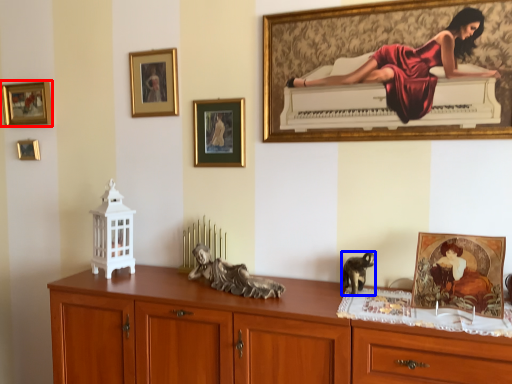
Question: Which object is further to the camera taking this photo, picture frame (highlighted by a red box) or animal (highlighted by a blue box)?

Choices:
 (A) picture frame
 (B) animal

Answer: (A)